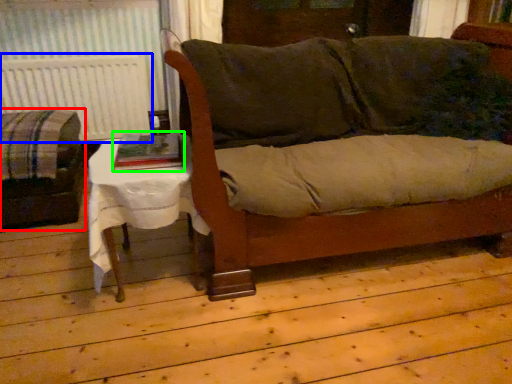
Question: Which object is the farthest from studio couch (highlighted by a red box)? Choose among these: radiator (highlighted by a blue box) or book (highlighted by a green box).

Choices:
 (A) radiator
 (B) book

Answer: (B)